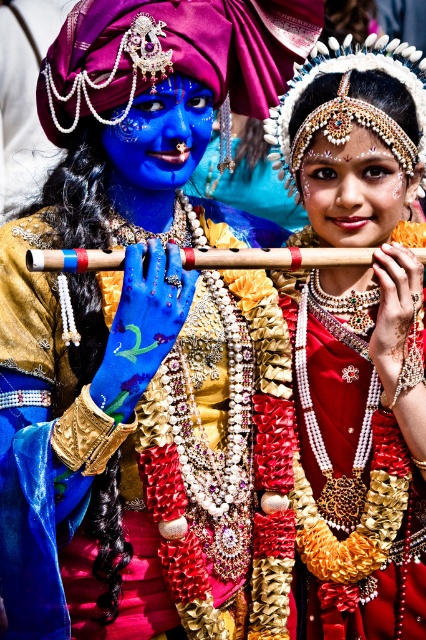
You are a photographer trying to capture a portrait of both the shiny gold fabric at center and the smooth skin face at center. Since you want to ensure both are in focus, you need to know their positions relative to each other. Which object is positioned to the left of the other?

The shiny gold fabric at center is to the left of smooth skin face at center.